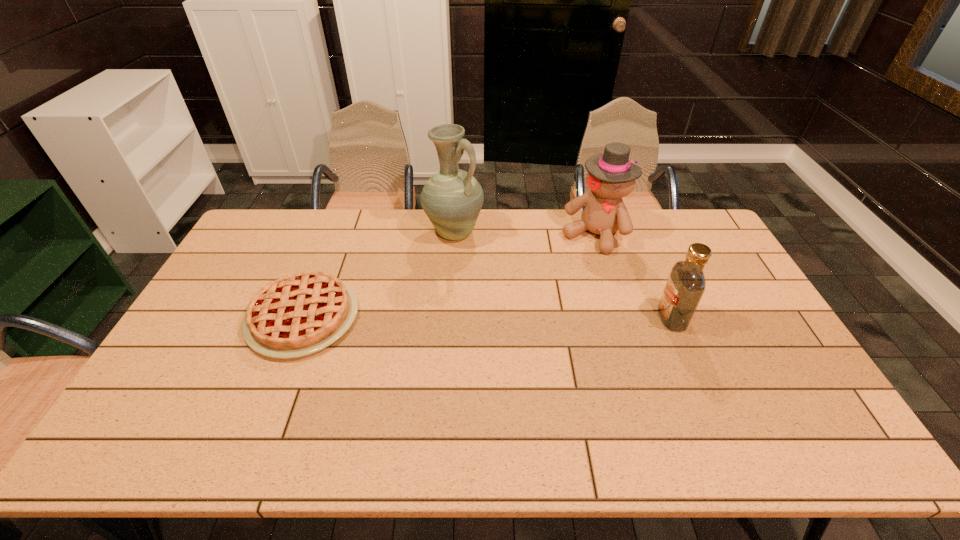
This screenshot has width=960, height=540. In order to click on vacant space that satisfies the following two spatial constraints: 1. on the front side of the rag_doll; 2. on the front-facing side of the second shortest object in this screenshot , I will do `click(619, 318)`.